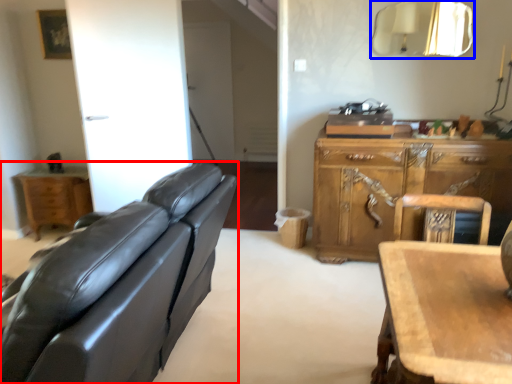
Question: Which object is further to the camera taking this photo, studio couch (highlighted by a red box) or mirror (highlighted by a blue box)?

Choices:
 (A) studio couch
 (B) mirror

Answer: (B)